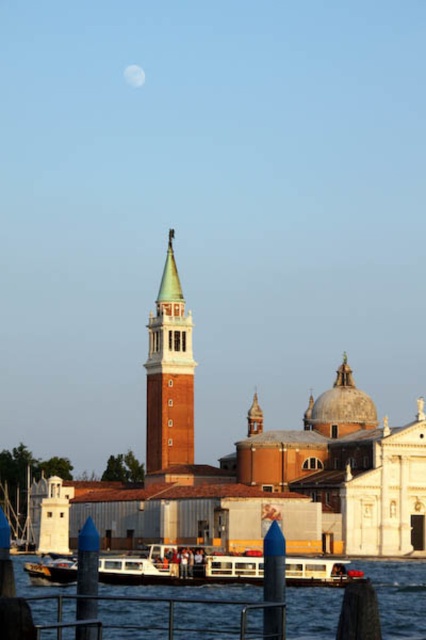
You are a tourist standing at the base of the tall bell tower with a green conical roof in Venice. You want to take a photo that includes both the point at coordinates point (210, 570) and point (43, 580). Which point will appear larger in your photo?

Point (210, 570) will appear larger in the photo because it is closer to the camera than point (43, 580).